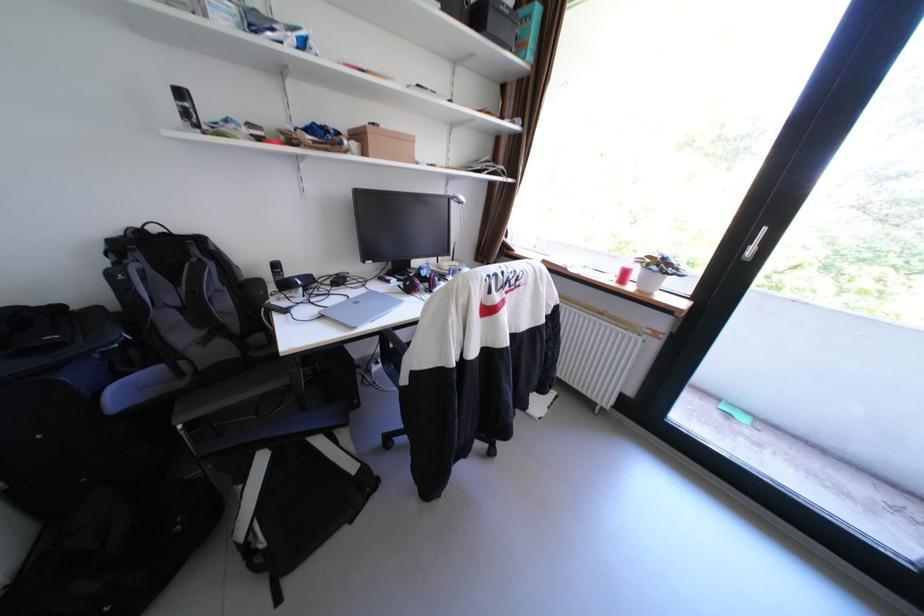
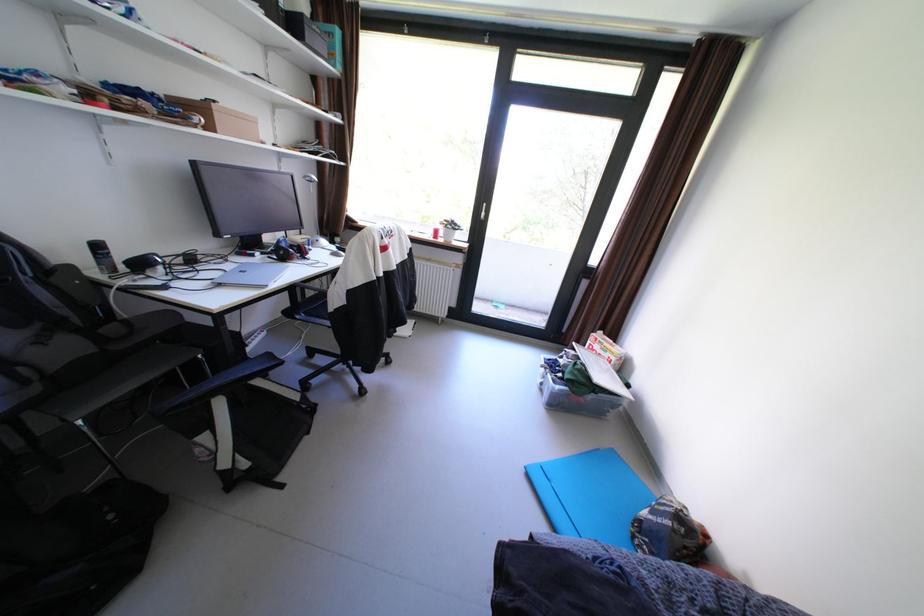
Locate, in the second image, the point that corresponds to point 354,300 in the first image.

(229, 273)